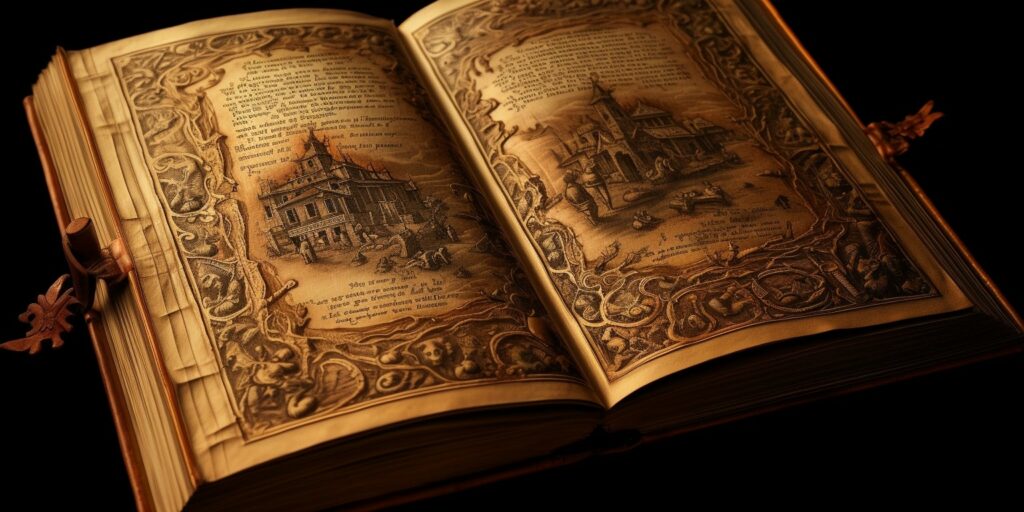
Locate an element on the screen. artwork is located at coordinates (316, 362).